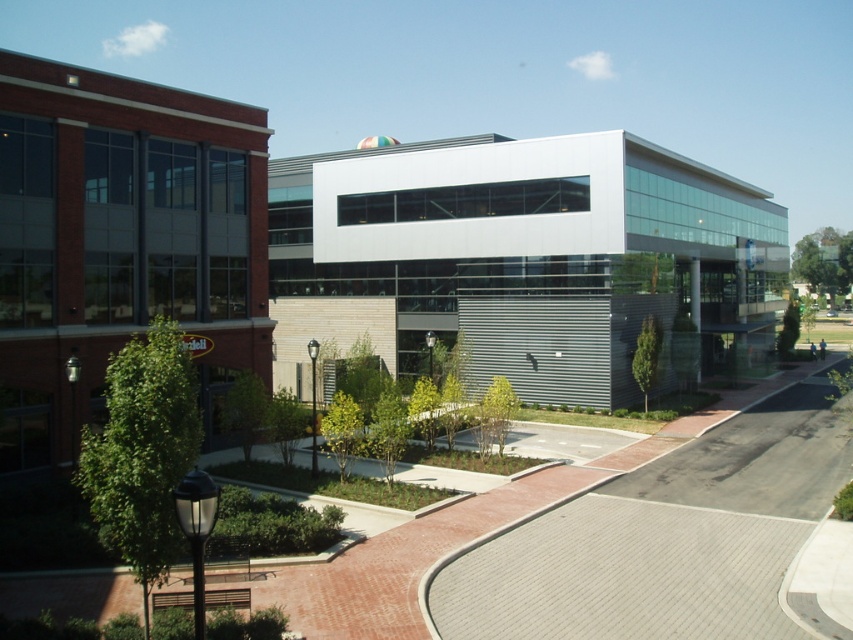
Question: Is white metallic building at center smaller than gray brick pavement at center?

Choices:
 (A) no
 (B) yes

Answer: (A)

Question: Among these points, which one is nearest to the camera?

Choices:
 (A) (692, 483)
 (B) (68, 156)

Answer: (A)

Question: Which point is closer to the camera taking this photo?

Choices:
 (A) (759, 496)
 (B) (74, 211)

Answer: (A)

Question: Estimate the real-world distances between objects in this image. Which object is farther from the white metallic building at center?

Choices:
 (A) gray brick pavement at center
 (B) brick building at left

Answer: (B)

Question: Does white metallic building at center appear over gray brick pavement at center?

Choices:
 (A) no
 (B) yes

Answer: (B)

Question: Does brick building at left have a lesser width compared to gray brick pavement at center?

Choices:
 (A) no
 (B) yes

Answer: (B)